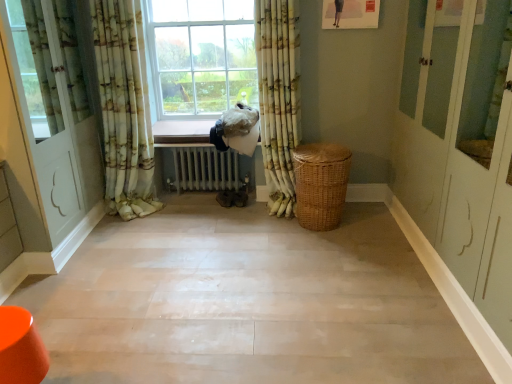
This screenshot has height=384, width=512. I want to click on woven brown basket at center-right, so click(x=320, y=184).

The width and height of the screenshot is (512, 384). Find the location of `floral fabric curtain at center, acting as the 2th curtain starting from the left`. floral fabric curtain at center, acting as the 2th curtain starting from the left is located at coordinates (278, 98).

This screenshot has width=512, height=384. In order to click on smooth beige floor at center in this screenshot , I will do `click(247, 302)`.

What do you see at coordinates (247, 302) in the screenshot? I see `smooth beige floor at center` at bounding box center [247, 302].

At what (x,y) coordinates should I click in order to perform the action: click on woven brown basket at center-right. Please return your answer as a coordinate pair (x, y). The width and height of the screenshot is (512, 384). Looking at the image, I should click on (320, 184).

Relative to floral fabric curtain at left, which ranks as the first curtain in left-to-right order, is smooth beige floor at center in front or behind?

smooth beige floor at center is in front of floral fabric curtain at left, which ranks as the first curtain in left-to-right order.

In the scene shown: Is floral fabric curtain at left, which ranks as the first curtain in left-to-right order, inside smooth beige floor at center?

No, floral fabric curtain at left, which ranks as the first curtain in left-to-right order, is located outside of smooth beige floor at center.

Which of these two, smooth beige floor at center or floral fabric curtain at left, which ranks as the first curtain in left-to-right order, stands shorter?

Standing shorter between the two is smooth beige floor at center.

Is smooth beige floor at center not near floral fabric curtain at left, which appears as the 2th curtain when viewed from the right?

Yes, smooth beige floor at center and floral fabric curtain at left, which appears as the 2th curtain when viewed from the right, are quite far apart.

Is white glossy door at left directly adjacent to smooth beige floor at center?

No, white glossy door at left is not in contact with smooth beige floor at center.

From a real-world perspective, does white glossy door at left sit lower than smooth beige floor at center?

No, from a real-world perspective, white glossy door at left is not under smooth beige floor at center.

Based on the photo, is white glossy door at left bigger or smaller than smooth beige floor at center?

white glossy door at left is bigger than smooth beige floor at center.

You are a GUI agent. You are given a task and a screenshot of the screen. Output one action in this format:
    pyautogui.click(x=<x>, y=<y>)
    Task: Click on the screen door above the smooth beige floor at center (from the image's perspective)
    Image resolution: width=512 pixels, height=384 pixels.
    Given the screenshot: What is the action you would take?
    pyautogui.click(x=45, y=121)

Which point is more distant from viewer, (312, 179) or (260, 14)?

The point (260, 14) is more distant.

At what (x,y) coordinates should I click in order to perform the action: click on the 1st curtain located above the woven brown basket at center-right (from a real-world perspective). Please return your answer as a coordinate pair (x, y). Looking at the image, I should click on (278, 98).

Does woven brown basket at center-right appear on the left side of floral fabric curtain at center, acting as the 2th curtain starting from the left?

Incorrect, woven brown basket at center-right is not on the left side of floral fabric curtain at center, acting as the 2th curtain starting from the left.

Considering the positions of objects woven brown basket at center-right and floral fabric curtain at center, acting as the 2th curtain starting from the left, in the image provided, who is in front, woven brown basket at center-right or floral fabric curtain at center, acting as the 2th curtain starting from the left,?

floral fabric curtain at center, acting as the 2th curtain starting from the left, is more forward.

From their relative heights in the image, would you say floral fabric curtain at center, positioned as the 1th curtain in right-to-left order, is taller or shorter than metallic radiator at center?

Considering their sizes, floral fabric curtain at center, positioned as the 1th curtain in right-to-left order, has more height than metallic radiator at center.

Looking at the image, does floral fabric curtain at center, positioned as the 1th curtain in right-to-left order, seem bigger or smaller compared to metallic radiator at center?

floral fabric curtain at center, positioned as the 1th curtain in right-to-left order, is bigger than metallic radiator at center.

From the image's perspective, who appears lower, floral fabric curtain at center, acting as the 2th curtain starting from the left, or metallic radiator at center?

metallic radiator at center is shown below in the image.

Is floral fabric curtain at center, acting as the 2th curtain starting from the left, inside or outside of metallic radiator at center?

floral fabric curtain at center, acting as the 2th curtain starting from the left, exists outside the volume of metallic radiator at center.

Is floral fabric curtain at center, acting as the 2th curtain starting from the left, oriented towards floral fabric curtain at left, which ranks as the first curtain in left-to-right order?

No, floral fabric curtain at center, acting as the 2th curtain starting from the left, does not turn towards floral fabric curtain at left, which ranks as the first curtain in left-to-right order.

Considering the relative positions of floral fabric curtain at center, acting as the 2th curtain starting from the left, and floral fabric curtain at left, which ranks as the first curtain in left-to-right order, in the image provided, is floral fabric curtain at center, acting as the 2th curtain starting from the left, to the right of floral fabric curtain at left, which ranks as the first curtain in left-to-right order, from the viewer's perspective?

Indeed, floral fabric curtain at center, acting as the 2th curtain starting from the left, is positioned on the right side of floral fabric curtain at left, which ranks as the first curtain in left-to-right order.

How different are the orientations of floral fabric curtain at center, positioned as the 1th curtain in right-to-left order, and floral fabric curtain at left, which appears as the 2th curtain when viewed from the right, in degrees?

The facing directions of floral fabric curtain at center, positioned as the 1th curtain in right-to-left order, and floral fabric curtain at left, which appears as the 2th curtain when viewed from the right, are 4.46 degrees apart.

Considering the sizes of objects floral fabric curtain at center, positioned as the 1th curtain in right-to-left order, and floral fabric curtain at left, which appears as the 2th curtain when viewed from the right, in the image provided, who is smaller, floral fabric curtain at center, positioned as the 1th curtain in right-to-left order, or floral fabric curtain at left, which appears as the 2th curtain when viewed from the right,?

floral fabric curtain at center, positioned as the 1th curtain in right-to-left order, is smaller.

Do you think floral fabric curtain at left, which ranks as the first curtain in left-to-right order, is within smooth beige floor at center, or outside of it?

floral fabric curtain at left, which ranks as the first curtain in left-to-right order, is not enclosed by smooth beige floor at center.

Are floral fabric curtain at left, which appears as the 2th curtain when viewed from the right, and smooth beige floor at center far apart?

Yes, floral fabric curtain at left, which appears as the 2th curtain when viewed from the right, and smooth beige floor at center are located far from each other.

Image resolution: width=512 pixels, height=384 pixels. I want to click on corridor that appears below the floral fabric curtain at left, which ranks as the first curtain in left-to-right order (from a real-world perspective), so click(x=247, y=302).

Can you tell me how much floral fabric curtain at left, which ranks as the first curtain in left-to-right order, and smooth beige floor at center differ in facing direction?

89 degrees separate the facing orientations of floral fabric curtain at left, which ranks as the first curtain in left-to-right order, and smooth beige floor at center.

From a real-world perspective, is metallic radiator at center on smooth beige floor at center?

Yes.

Is point (236, 179) positioned in front of point (228, 300)?

No, (236, 179) is behind (228, 300).

Who is taller, metallic radiator at center or smooth beige floor at center?

metallic radiator at center is taller.

Is metallic radiator at center positioned beyond the bounds of smooth beige floor at center?

That's correct, metallic radiator at center is outside of smooth beige floor at center.

The image size is (512, 384). I want to click on corridor that appears in front of the floral fabric curtain at left, which ranks as the first curtain in left-to-right order, so click(247, 302).

Where is `screen door above the smooth beige floor at center (from a real-world perspective)`? The height and width of the screenshot is (384, 512). screen door above the smooth beige floor at center (from a real-world perspective) is located at coordinates (45, 121).

From the image, which object appears to be farther from floral fabric curtain at left, which appears as the 2th curtain when viewed from the right, smooth beige floor at center or white glossy door at left?

smooth beige floor at center is positioned further to the anchor floral fabric curtain at left, which appears as the 2th curtain when viewed from the right.

From the image, which object appears to be nearer to metallic radiator at center, floral fabric curtain at center, positioned as the 1th curtain in right-to-left order, or white glossy door at left?

floral fabric curtain at center, positioned as the 1th curtain in right-to-left order, is positioned closer to the anchor metallic radiator at center.

Which object lies further to the anchor point metallic radiator at center, smooth beige floor at center or floral fabric curtain at left, which ranks as the first curtain in left-to-right order?

smooth beige floor at center lies further to metallic radiator at center than the other object.

Which object lies further to the anchor point white glossy door at left, floral fabric curtain at left, which ranks as the first curtain in left-to-right order, or metallic radiator at center?

metallic radiator at center is positioned further to the anchor white glossy door at left.

Looking at the image, which one is located closer to white glossy door at left, woven brown basket at center-right or floral fabric curtain at left, which appears as the 2th curtain when viewed from the right?

floral fabric curtain at left, which appears as the 2th curtain when viewed from the right, lies closer to white glossy door at left than the other object.

From the image, which object appears to be nearer to white glossy door at left, woven brown basket at center-right or smooth beige floor at center?

Based on the image, smooth beige floor at center appears to be nearer to white glossy door at left.

When comparing their distances from smooth beige floor at center, does woven brown basket at center-right or floral fabric curtain at left, which ranks as the first curtain in left-to-right order, seem further?

floral fabric curtain at left, which ranks as the first curtain in left-to-right order, is further to smooth beige floor at center.

In the scene shown: Looking at the image, which one is located closer to floral fabric curtain at center, positioned as the 1th curtain in right-to-left order, white glossy door at left or metallic radiator at center?

The object closer to floral fabric curtain at center, positioned as the 1th curtain in right-to-left order, is metallic radiator at center.

This screenshot has height=384, width=512. I want to click on curtain situated between white glossy door at left and floral fabric curtain at center, acting as the 2th curtain starting from the left, from left to right, so click(123, 111).

This screenshot has height=384, width=512. What are the coordinates of `corridor between floral fabric curtain at left, which ranks as the first curtain in left-to-right order, and woven brown basket at center-right from left to right` in the screenshot? It's located at (247, 302).

You are a GUI agent. You are given a task and a screenshot of the screen. Output one action in this format:
    pyautogui.click(x=<x>, y=<y>)
    Task: Click on the radiator located between floral fabric curtain at left, which ranks as the first curtain in left-to-right order, and woven brown basket at center-right in the left-right direction
    The width and height of the screenshot is (512, 384).
    Given the screenshot: What is the action you would take?
    pyautogui.click(x=205, y=169)

This screenshot has height=384, width=512. I want to click on curtain situated between metallic radiator at center and woven brown basket at center-right from left to right, so click(x=278, y=98).